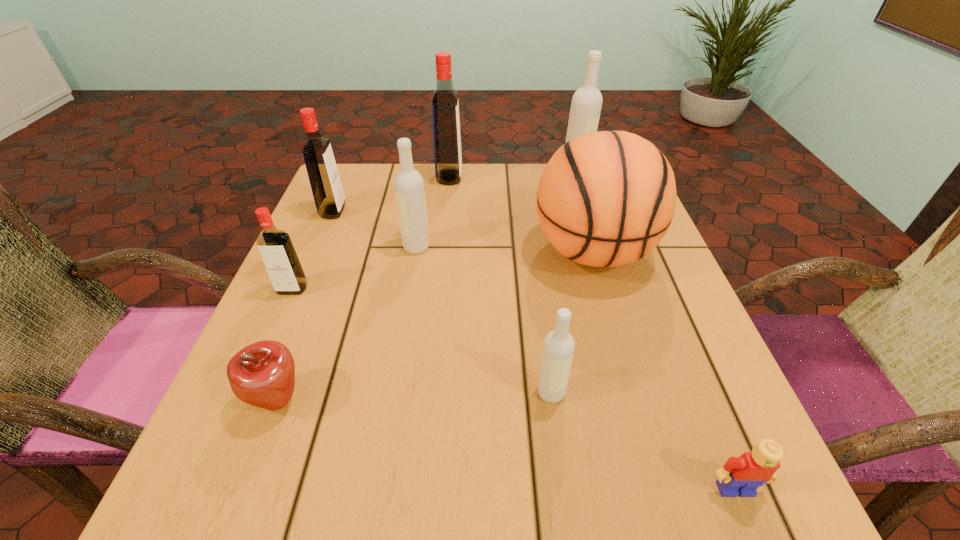
Find the location of a particular element. blank area located 0.380m on the front and back of the fifth farthest vodka is located at coordinates (193, 515).

Where is `vacant space located 0.220m on the left of the smallest white vodka`? Image resolution: width=960 pixels, height=540 pixels. vacant space located 0.220m on the left of the smallest white vodka is located at coordinates (393, 393).

This screenshot has width=960, height=540. In order to click on blank area located 0.380m on the right of the apple in this screenshot , I will do `click(559, 400)`.

Image resolution: width=960 pixels, height=540 pixels. What are the coordinates of `object located at the near edge` in the screenshot? It's located at (742, 475).

Find the location of a particular element. The image size is (960, 540). apple present at the left edge is located at coordinates (262, 374).

At what (x,y) coordinates should I click in order to perform the action: click on vodka positioned at the right edge. Please return your answer as a coordinate pair (x, y). The image size is (960, 540). Looking at the image, I should click on (586, 104).

The image size is (960, 540). What are the coordinates of `basketball that is at the right edge` in the screenshot? It's located at (605, 199).

Identify the location of Lego situated at the right edge. Image resolution: width=960 pixels, height=540 pixels. (742, 475).

Find the location of a particular element. The image size is (960, 540). object present at the far left corner is located at coordinates (327, 190).

This screenshot has width=960, height=540. In order to click on object located at the far right corner in this screenshot , I will do `click(586, 104)`.